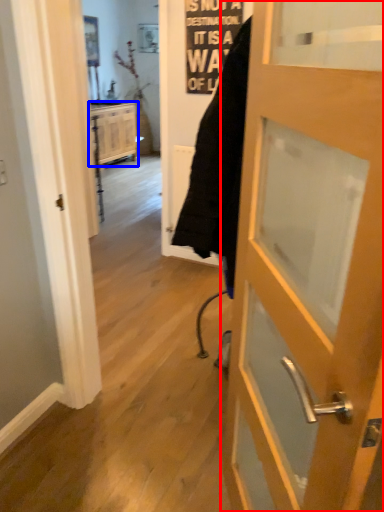
Question: Which point is closer to the camera, door (highlighted by a red box) or cabinetry (highlighted by a blue box)?

Choices:
 (A) door
 (B) cabinetry

Answer: (A)